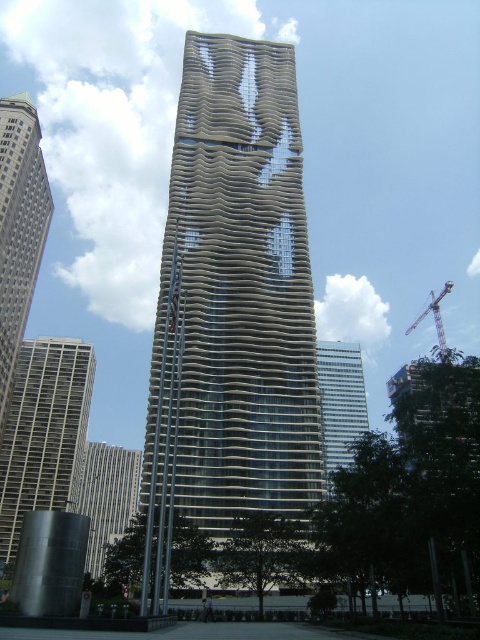
You are an architect analyzing the layout of the city skyline. You notice the brown textured building at center and the matte gray skyscraper at left. Based on their positions, which building is closer to the right edge of the image?

The brown textured building at center is to the right of the matte gray skyscraper at left, so the brown textured building at center is closer to the right edge of the image.

You are standing at the center of the image. Which direction should you look to see the brown textured building at center?

The brown textured building at center is located at the center of the image, so you should look straight ahead to see it.

Based on the scene description, where is the gray concrete building at left located in terms of coordinates?

The gray concrete building at left is located at point (44,433).